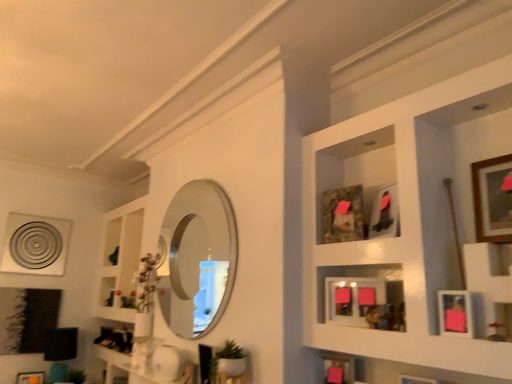
Question: From their relative heights in the image, would you say matte orange picture frame at lower left, the eighth picture frame positioned from the top, is taller or shorter than pink matte picture frame at lower right, the fourth picture frame in the top-to-bottom sequence?

Choices:
 (A) tall
 (B) short

Answer: (A)

Question: Is point (36, 377) positioned closer to the camera than point (467, 309)?

Choices:
 (A) closer
 (B) farther

Answer: (B)

Question: Considering the real-world distances, which object is farthest from the pink matte picture frame at lower right, which ranks as the fifth picture frame in bottom-to-top order?

Choices:
 (A) matte pink picture frame at center, the fifth picture frame viewed from the front
 (B) polished silver mirror at center
 (C) wooden picture frame at lower right, the 3th picture frame viewed from the right
 (D) wooden picture frames at upper right
 (E) green matte plant at lower center

Answer: (B)

Question: Which object is positioned closest to the wooden picture frame at lower right, the sixth picture frame in the left-to-right sequence?

Choices:
 (A) pink matte picture frame at lower right, the fourth picture frame in the top-to-bottom sequence
 (B) matte orange picture frame at lower left, arranged as the seventh picture frame when viewed from the front
 (C) matte black picture frame at upper center, marked as the 2th picture frame in a top-to-bottom arrangement
 (D) metallic silver circular object at upper left, acting as the 3th picture frame starting from the bottom
 (E) wooden picture frames at upper right

Answer: (A)